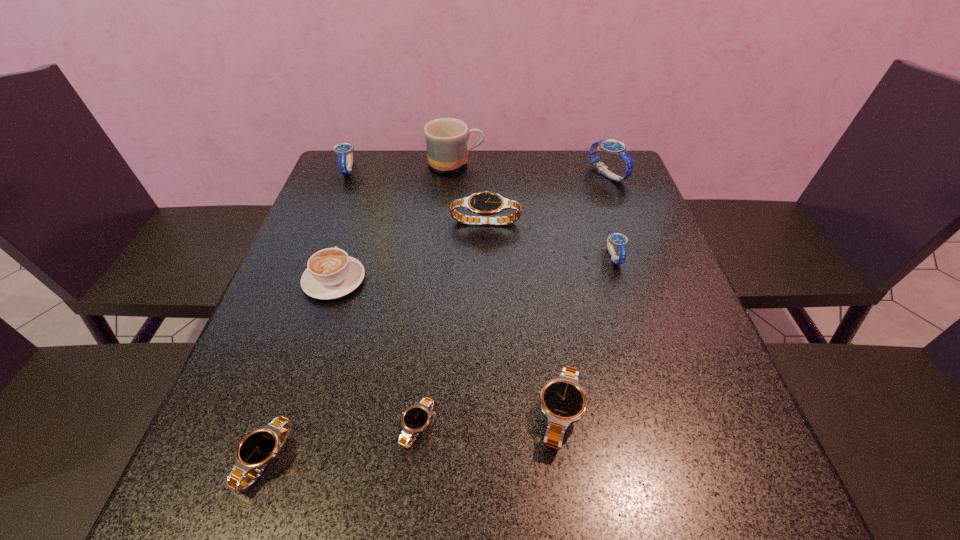
The height and width of the screenshot is (540, 960). Find the location of `the second biggest black watch`. the second biggest black watch is located at coordinates (563, 401).

Find the location of a particular element. This screenshot has height=540, width=960. the eighth tallest object is located at coordinates (256, 450).

Where is `the second smallest black watch`? This screenshot has height=540, width=960. the second smallest black watch is located at coordinates (256, 450).

The height and width of the screenshot is (540, 960). I want to click on the fifth watch from right to left, so click(x=416, y=418).

This screenshot has width=960, height=540. What are the coordinates of `the shortest object` in the screenshot? It's located at (416, 418).

I want to click on vacant space located on the side with the handle of the tallest object, so click(554, 164).

Identify the location of vacant space located on the back of the biggest blue watch. click(x=597, y=149).

Find the location of a particular element. The width and height of the screenshot is (960, 540). free space located 0.200m on the right of the second biggest blue watch is located at coordinates (425, 170).

Locate an element on the screen. vacant space located on the left of the biggest black watch is located at coordinates (342, 221).

What are the coordinates of `free space located 0.340m on the side of the cappuccino with the handle` in the screenshot? It's located at (368, 180).